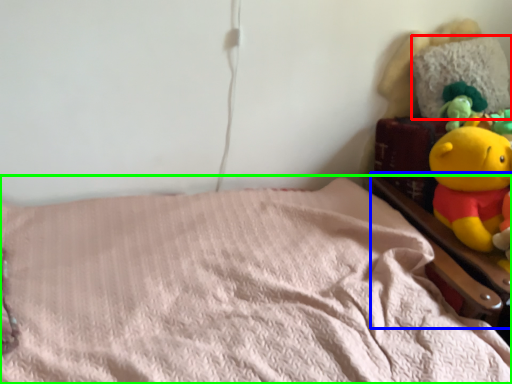
Question: Which object is the closest to the pillow (highlighted by a red box)? Choose among these: bed frame (highlighted by a blue box) or bed (highlighted by a green box).

Choices:
 (A) bed frame
 (B) bed

Answer: (A)